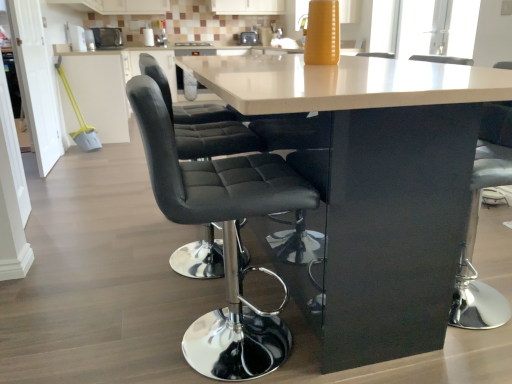
Where is `vacant region to the left of glossy black table at center`? vacant region to the left of glossy black table at center is located at coordinates (106, 247).